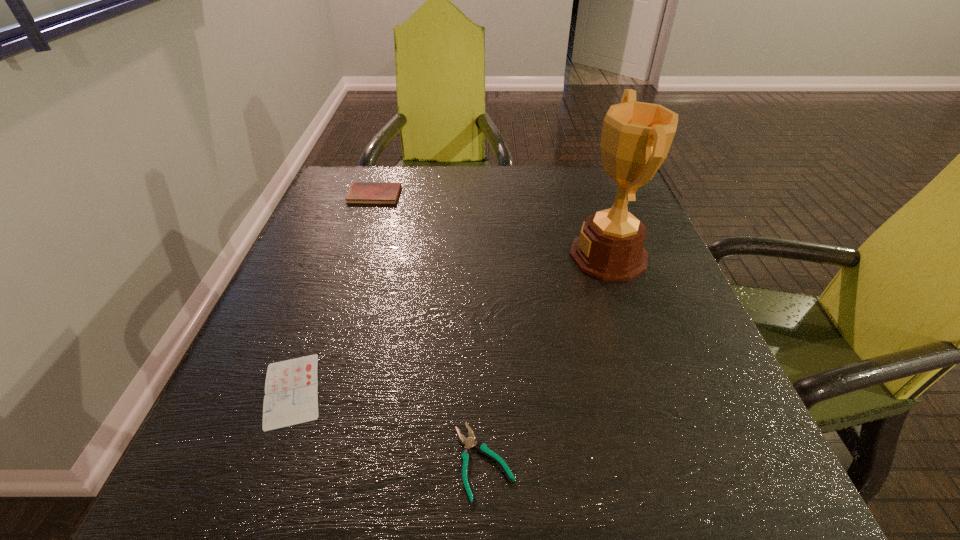
Find the location of `free space that is in between the third object from left to right and the nearer diary`. free space that is in between the third object from left to right and the nearer diary is located at coordinates (388, 426).

You are a GUI agent. You are given a task and a screenshot of the screen. Output one action in this format:
    pyautogui.click(x=<x>, y=<y>)
    Task: Click on the blank region between the second object from right to left and the nearer diary
    This screenshot has width=960, height=540.
    Given the screenshot: What is the action you would take?
    pyautogui.click(x=388, y=426)

You are a GUI agent. You are given a task and a screenshot of the screen. Output one action in this format:
    pyautogui.click(x=<x>, y=<y>)
    Task: Click on the vacant point located between the rightmost object and the third object from left to right
    
    Given the screenshot: What is the action you would take?
    pyautogui.click(x=546, y=358)

Find the location of a particular element. The image size is (960, 540). object that is the closest to the third object from left to right is located at coordinates (291, 388).

This screenshot has height=540, width=960. What are the coordinates of `object that ranks as the second closest to the second object from right to left` in the screenshot? It's located at (636, 137).

At what (x,y) coordinates should I click in order to perform the action: click on vacant area in the image that satisfies the following two spatial constraints: 1. on the front-facing side of the tallest object; 2. on the front side of the shorter diary. Please return your answer as a coordinate pair (x, y). The image size is (960, 540). Looking at the image, I should click on (654, 390).